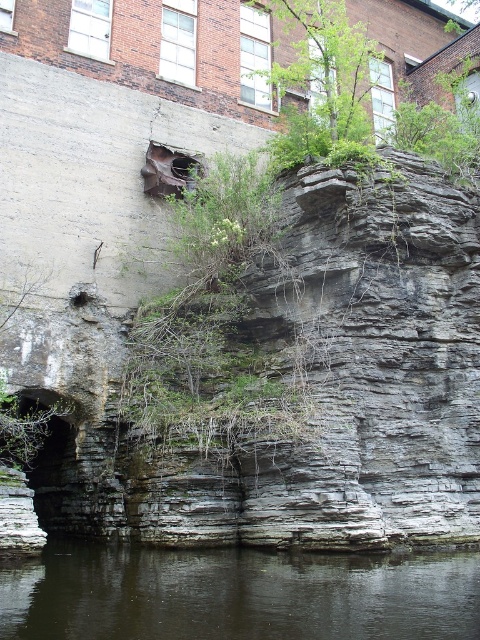
Question: Which point is closer to the camera?

Choices:
 (A) green leafy tree at upper center
 (B) dark gray water at lower center

Answer: (B)

Question: Does dark gray water at lower center appear on the left side of green leafy tree at upper center?

Choices:
 (A) no
 (B) yes

Answer: (B)

Question: Can you confirm if dark gray water at lower center is wider than green leafy tree at upper center?

Choices:
 (A) no
 (B) yes

Answer: (B)

Question: Which of the following is the farthest from the observer?

Choices:
 (A) (15, 618)
 (B) (336, 102)

Answer: (B)

Question: Does dark gray water at lower center have a greater width compared to green leafy tree at upper center?

Choices:
 (A) no
 (B) yes

Answer: (B)

Question: Which object appears farthest from the camera in this image?

Choices:
 (A) dark gray water at lower center
 (B) green leafy tree at upper center

Answer: (B)